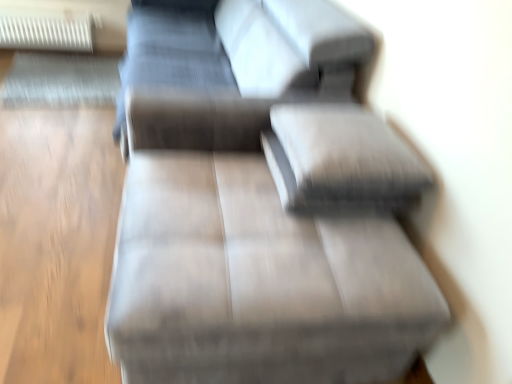
Measure the distance between point (319, 97) and camera.

Point (319, 97) is 1.81 meters away from camera.

Measure the distance between white plastic radiator at upper left and camera.

3.20 meters.

The image size is (512, 384). I want to click on matte gray couch at center, so click(x=231, y=70).

Is white plastic radiator at upper left positioned before matte gray couch at center?

No.

Is point (87, 19) closer or farther from the camera than point (345, 54)?

Point (87, 19) is positioned farther from the camera compared to point (345, 54).

Considering the relative sizes of white plastic radiator at upper left and matte gray couch at center in the image provided, is white plastic radiator at upper left taller than matte gray couch at center?

No, white plastic radiator at upper left is not taller than matte gray couch at center.

Would you consider white plastic radiator at upper left to be distant from matte gray couch at center?

Yes, white plastic radiator at upper left and matte gray couch at center are quite far apart.

Is matte gray couch at center to the right of textured gray pillow at center from the viewer's perspective?

In fact, matte gray couch at center is to the left of textured gray pillow at center.

Which object is thinner, matte gray couch at center or textured gray pillow at center?

textured gray pillow at center.

Find the location of a particular element. The width and height of the screenshot is (512, 384). pillow below the matte gray couch at center (from the image's perspective) is located at coordinates (339, 160).

From the image's perspective, is matte gray couch at center located above or below textured gray pillow at center?

matte gray couch at center is above textured gray pillow at center.

Consider the image. In terms of height, does suede-like gray couch at center look taller or shorter compared to textured gray pillow at center?

Considering their sizes, suede-like gray couch at center has more height than textured gray pillow at center.

Is suede-like gray couch at center next to textured gray pillow at center and touching it?

No, suede-like gray couch at center is not next to textured gray pillow at center.

How distant is suede-like gray couch at center from textured gray pillow at center?

A distance of 5.98 inches exists between suede-like gray couch at center and textured gray pillow at center.

Which object is positioned more to the left, suede-like gray couch at center or textured gray pillow at center?

Positioned to the left is suede-like gray couch at center.

Is textured gray pillow at center looking in the opposite direction of suede-like gray couch at center?

That's not correct — textured gray pillow at center is not looking away from suede-like gray couch at center.

Is point (290, 133) in front of point (426, 278)?

No, it is behind (426, 278).

From the image's perspective, which one is positioned higher, textured gray pillow at center or suede-like gray couch at center?

textured gray pillow at center, from the image's perspective.

Between textured gray pillow at center and suede-like gray couch at center, which one has smaller size?

With smaller size is textured gray pillow at center.

Can you confirm if matte gray couch at center is taller than white plastic radiator at upper left?

Indeed, matte gray couch at center has a greater height compared to white plastic radiator at upper left.

Is matte gray couch at center oriented away from white plastic radiator at upper left?

No.

Does matte gray couch at center have a smaller size compared to white plastic radiator at upper left?

Incorrect, matte gray couch at center is not smaller in size than white plastic radiator at upper left.

Can you confirm if matte gray couch at center is thinner than white plastic radiator at upper left?

No, matte gray couch at center is not thinner than white plastic radiator at upper left.

Does matte gray couch at center turn towards suede-like gray couch at center?

No, matte gray couch at center is not oriented towards suede-like gray couch at center.

Considering their positions, is matte gray couch at center located in front of or behind suede-like gray couch at center?

matte gray couch at center is behind suede-like gray couch at center.

Image resolution: width=512 pixels, height=384 pixels. I want to click on couch above the suede-like gray couch at center (from a real-world perspective), so click(x=231, y=70).

Which object is thinner, matte gray couch at center or suede-like gray couch at center?

suede-like gray couch at center is thinner.

Who is bigger, textured gray pillow at center or white plastic radiator at upper left?

With larger size is white plastic radiator at upper left.

This screenshot has height=384, width=512. I want to click on radiator below the textured gray pillow at center (from a real-world perspective), so click(46, 30).

Which object is positioned more to the right, textured gray pillow at center or white plastic radiator at upper left?

Positioned to the right is textured gray pillow at center.

Identify the location of radiator below the matte gray couch at center (from a real-world perspective). tap(46, 30).

Locate an element on the screen. This screenshot has width=512, height=384. couch on the left of textured gray pillow at center is located at coordinates (231, 70).

Based on their spatial positions, is white plastic radiator at upper left or textured gray pillow at center further from matte gray couch at center?

white plastic radiator at upper left lies further to matte gray couch at center than the other object.

Which object lies nearer to the anchor point suede-like gray couch at center, white plastic radiator at upper left or matte gray couch at center?

matte gray couch at center is closer to suede-like gray couch at center.

Considering their positions, is white plastic radiator at upper left positioned closer to textured gray pillow at center than matte gray couch at center?

matte gray couch at center lies closer to textured gray pillow at center than the other object.

Estimate the real-world distances between objects in this image. Which object is closer to matte gray couch at center, textured gray pillow at center or suede-like gray couch at center?

suede-like gray couch at center lies closer to matte gray couch at center than the other object.

When comparing their distances from textured gray pillow at center, does suede-like gray couch at center or white plastic radiator at upper left seem closer?

suede-like gray couch at center is positioned closer to the anchor textured gray pillow at center.

Which object lies nearer to the anchor point suede-like gray couch at center, textured gray pillow at center or white plastic radiator at upper left?

textured gray pillow at center is positioned closer to the anchor suede-like gray couch at center.

Looking at this image, from the image, which object appears to be farther from white plastic radiator at upper left, suede-like gray couch at center or textured gray pillow at center?

Among the two, textured gray pillow at center is located further to white plastic radiator at upper left.

Which object lies nearer to the anchor point matte gray couch at center, suede-like gray couch at center or textured gray pillow at center?

suede-like gray couch at center is closer to matte gray couch at center.

You are a GUI agent. You are given a task and a screenshot of the screen. Output one action in this format:
    pyautogui.click(x=<x>, y=<y>)
    Task: Click on the pillow positioned between suede-like gray couch at center and white plastic radiator at upper left from near to far
    
    Given the screenshot: What is the action you would take?
    pyautogui.click(x=339, y=160)

Locate an element on the screen. This screenshot has height=384, width=512. couch located between suede-like gray couch at center and white plastic radiator at upper left in the depth direction is located at coordinates (231, 70).

This screenshot has width=512, height=384. I want to click on pillow between matte gray couch at center and suede-like gray couch at center from top to bottom, so click(x=339, y=160).

You are a GUI agent. You are given a task and a screenshot of the screen. Output one action in this format:
    pyautogui.click(x=<x>, y=<y>)
    Task: Click on the couch positioned between textured gray pillow at center and white plastic radiator at upper left from near to far
    The width and height of the screenshot is (512, 384).
    Given the screenshot: What is the action you would take?
    pyautogui.click(x=231, y=70)